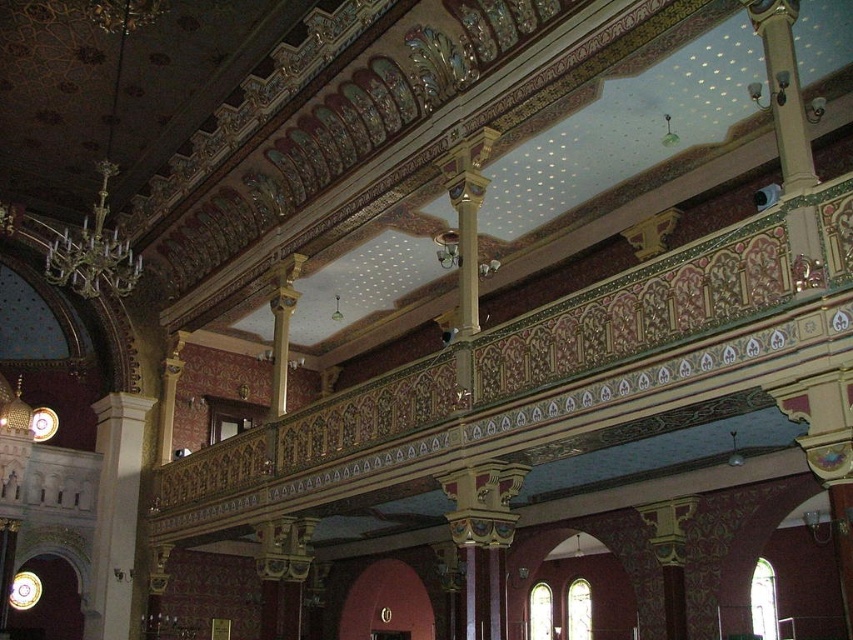
You are standing inside the grand mosque and want to take a photo that includes both point A at location point (97, 496) and point B at location point (102, 161). Which point should you focus on first to ensure both are in clear view?

You should focus on point A at location point (97, 496) first because it is closer to you than point B at location point (102, 161), ensuring both points are in clear view.

You are standing in the grand interior of a mosque. You need to locate the white marble column at left. According to the coordinates provided, where exactly is it positioned?

The white marble column at left is located at point [115,513].